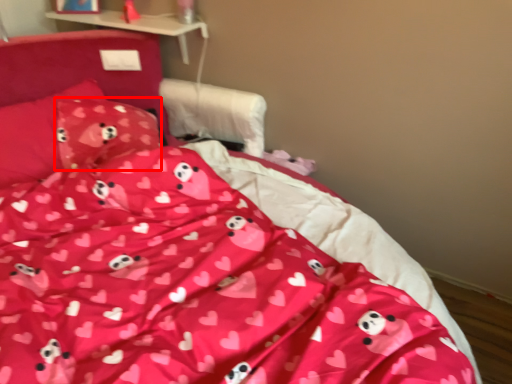
Question: In this image, where is pillow (annotated by the red box) located relative to pillow?

Choices:
 (A) right
 (B) left

Answer: (A)